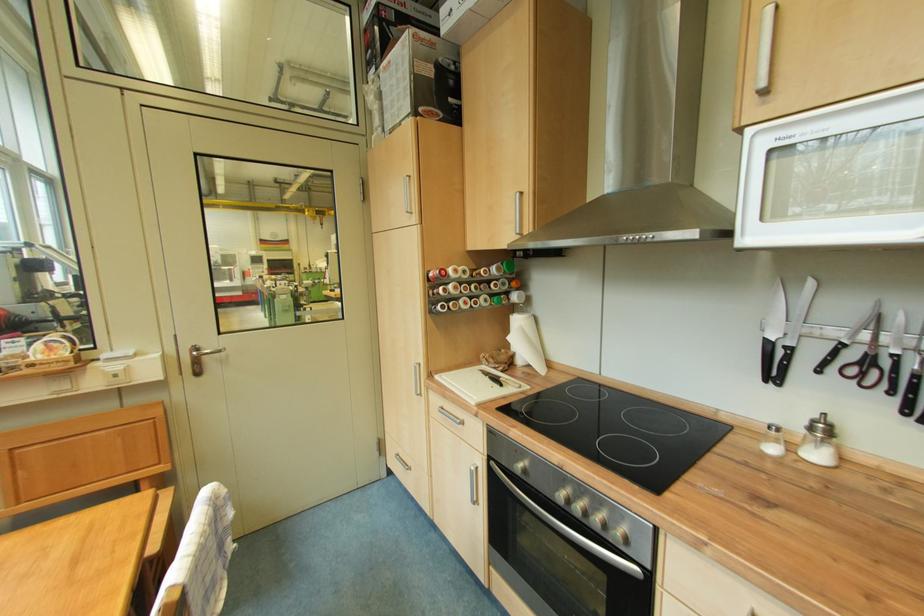
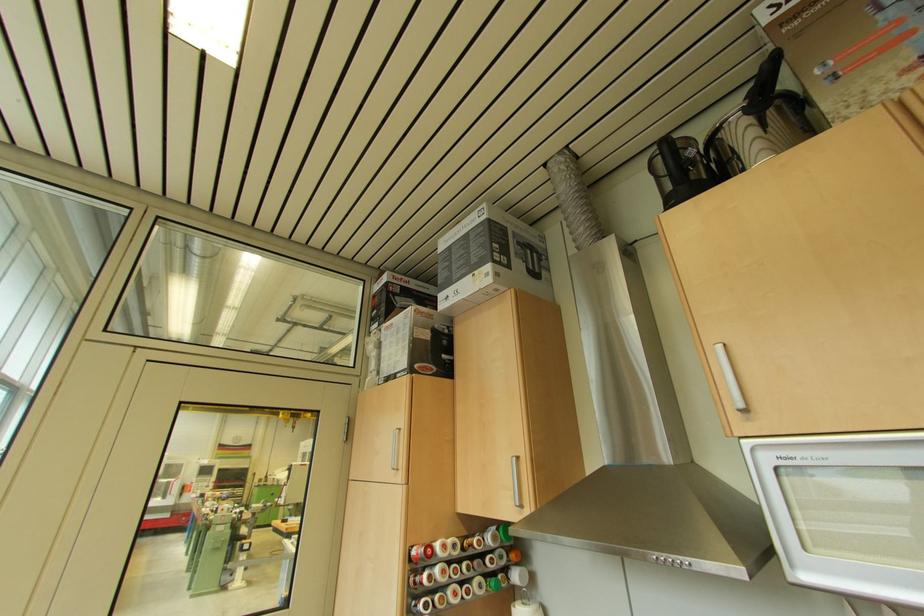
Question: The first image is from the beginning of the video and the second image is from the end. How did the camera likely rotate when shooting the video?

Choices:
 (A) Left
 (B) Right
 (C) Up
 (D) Down

Answer: (C)